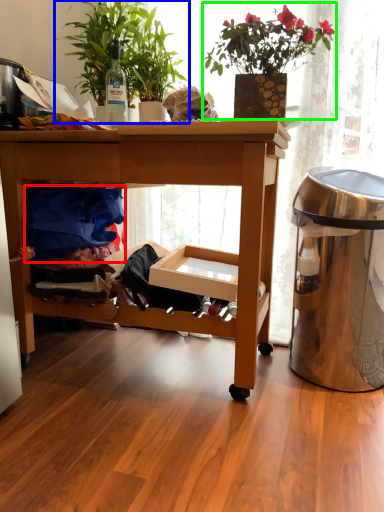
Question: Which is nearer to the clothing (highlighted by a red box)? houseplant (highlighted by a blue box) or houseplant (highlighted by a green box).

Choices:
 (A) houseplant
 (B) houseplant

Answer: (A)